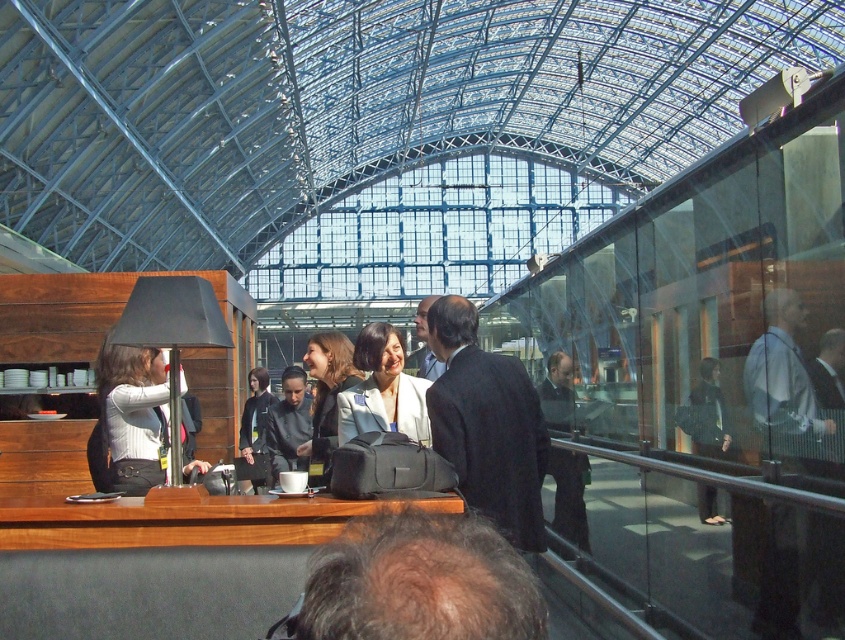
Question: Is black suit at center positioned in front of dark suit at right?

Choices:
 (A) yes
 (B) no

Answer: (A)

Question: Which object is farther from the camera taking this photo?

Choices:
 (A) black suit at center
 (B) light blue shirt at right
 (C) matte black jacket at left

Answer: (C)

Question: Among these points, which one is farthest from the camera?

Choices:
 (A) (113, 364)
 (B) (433, 362)
 (C) (435, 321)

Answer: (B)

Question: Can you confirm if matte black jacket at left is positioned above dark gray suit at center?

Choices:
 (A) no
 (B) yes

Answer: (B)

Question: Is dark gray suit at center to the right of dark blue suit at center from the viewer's perspective?

Choices:
 (A) yes
 (B) no

Answer: (B)

Question: Which point appears farthest from the camera in this image?

Choices:
 (A) (491, 516)
 (B) (794, 429)
 (C) (281, 387)
 (D) (548, 372)

Answer: (C)